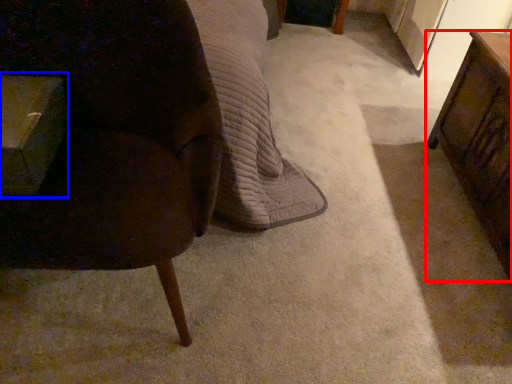
Question: Which object is further to the camera taking this photo, table (highlighted by a red box) or table (highlighted by a blue box)?

Choices:
 (A) table
 (B) table

Answer: (A)